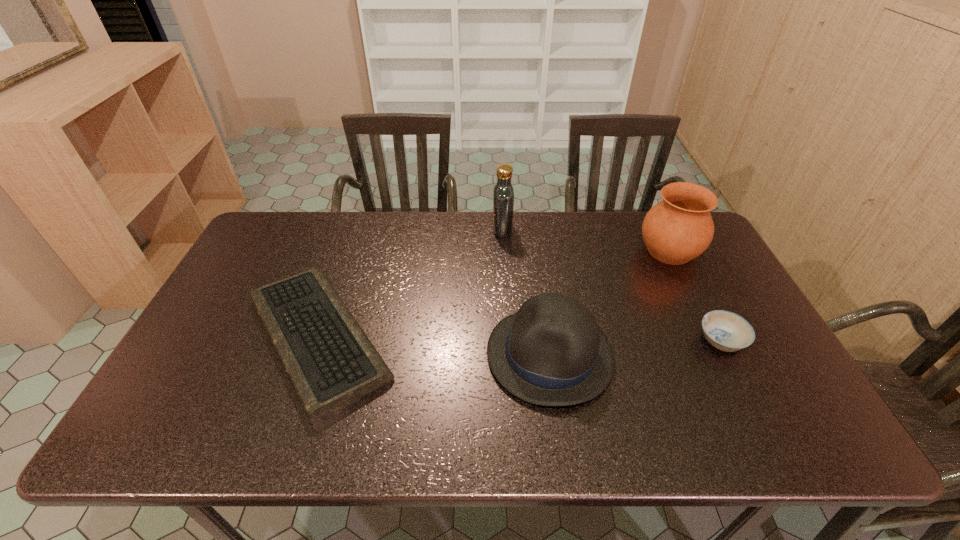
Find the location of a particular element. blank space located 0.210m on the front-facing side of the third shortest object is located at coordinates (405, 354).

Find the location of `free region located on the front-facing side of the third shortest object`. free region located on the front-facing side of the third shortest object is located at coordinates (382, 354).

The image size is (960, 540). Find the location of `free space located 0.180m on the left of the bowl`. free space located 0.180m on the left of the bowl is located at coordinates (629, 341).

This screenshot has width=960, height=540. I want to click on free space located on the right of the computer keyboard, so click(x=424, y=338).

Find the location of a particular element. This screenshot has height=540, width=960. vodka that is positioned at the far edge is located at coordinates (503, 193).

You are a GUI agent. You are given a task and a screenshot of the screen. Output one action in this format:
    pyautogui.click(x=<x>, y=<y>)
    Task: Click on the pottery that is at the far edge
    
    Given the screenshot: What is the action you would take?
    pyautogui.click(x=679, y=228)

Image resolution: width=960 pixels, height=540 pixels. Identify the location of object present at the near edge. (330, 361).

The width and height of the screenshot is (960, 540). What are the coordinates of `object that is at the left edge` in the screenshot? It's located at click(x=330, y=361).

I want to click on pottery that is positioned at the right edge, so click(679, 228).

At what (x,y) coordinates should I click in order to perform the action: click on bowl located at the right edge. Please return your answer as a coordinate pair (x, y). Looking at the image, I should click on (727, 331).